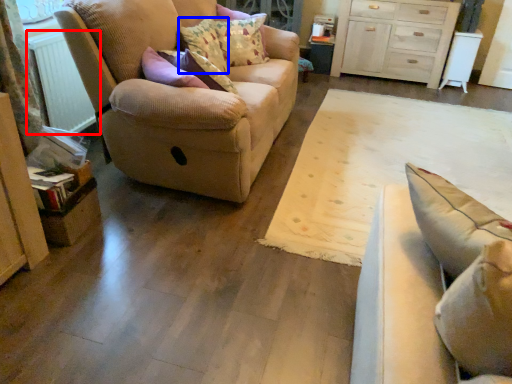
Question: Which object appears farthest to the camera in this image, radiator (highlighted by a red box) or pillow (highlighted by a blue box)?

Choices:
 (A) radiator
 (B) pillow

Answer: (B)